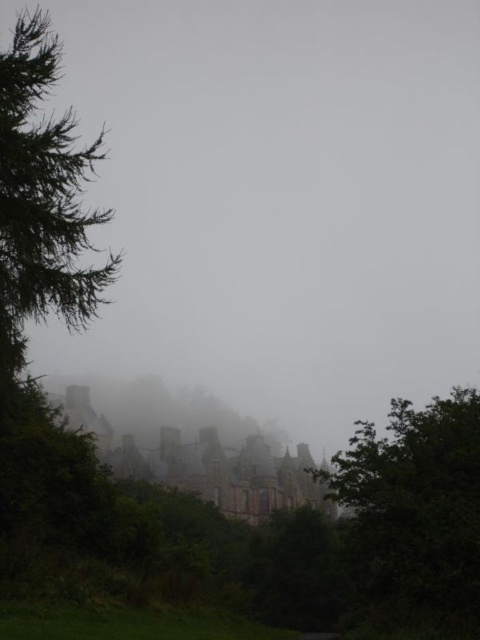
Is foggy translucent cloud at center closer to the viewer compared to green leafy tree at lower right?

No, foggy translucent cloud at center is further to the viewer.

Can you confirm if foggy translucent cloud at center is positioned to the right of green leafy tree at lower right?

Indeed, foggy translucent cloud at center is positioned on the right side of green leafy tree at lower right.

Identify the location of foggy translucent cloud at center. The width and height of the screenshot is (480, 640). (279, 200).

Which of these two, foggy translucent cloud at center or green needle-like leaves at left, stands shorter?

green needle-like leaves at left

Does foggy translucent cloud at center have a lesser width compared to green needle-like leaves at left?

In fact, foggy translucent cloud at center might be wider than green needle-like leaves at left.

Which is behind, point (377, 13) or point (14, 272)?

Point (377, 13)

At what (x,y) coordinates should I click in order to perform the action: click on foggy translucent cloud at center. Please return your answer as a coordinate pair (x, y). The height and width of the screenshot is (640, 480). Looking at the image, I should click on (279, 200).

Does green leafy tree at lower right come behind green needle-like leaves at left?

No, it is not.

Is point (429, 547) less distant than point (12, 259)?

Yes.

This screenshot has width=480, height=640. Identify the location of green leafy tree at lower right. (412, 513).